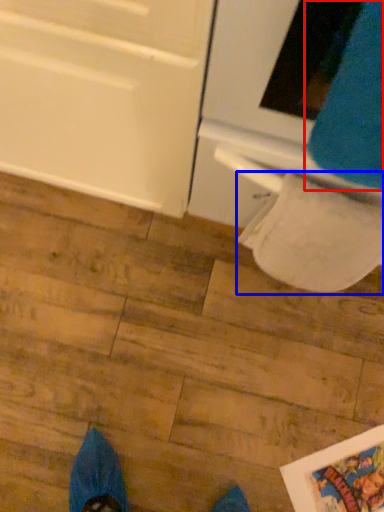
Question: Which of the following is the farthest to the observer, sweat pant (highlighted by a red box) or toilet paper (highlighted by a blue box)?

Choices:
 (A) sweat pant
 (B) toilet paper

Answer: (B)